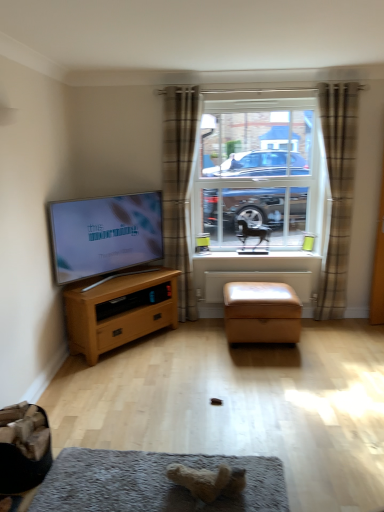
I want to click on vacant space that is to the left of fuzzy beige teddy bear at lower center, positioned as the first animal in front-to-back order, so click(140, 481).